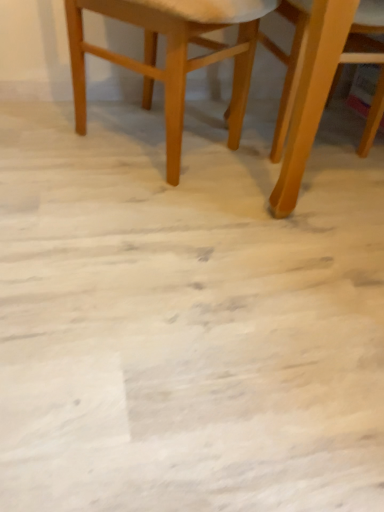
This screenshot has height=512, width=384. I want to click on free spot in front of light brown wooden chair at upper right, arranged as the 1th chair when viewed from the right, so click(x=230, y=333).